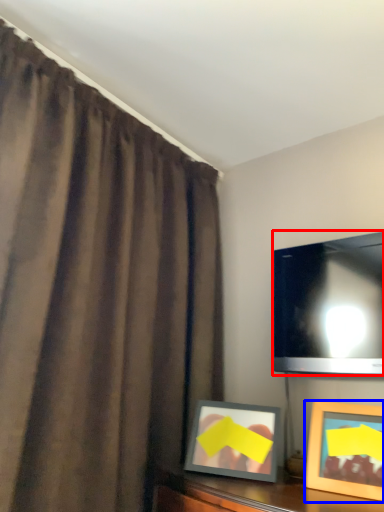
Question: Which object is further to the camera taking this photo, television (highlighted by a red box) or picture frame (highlighted by a blue box)?

Choices:
 (A) television
 (B) picture frame

Answer: (A)